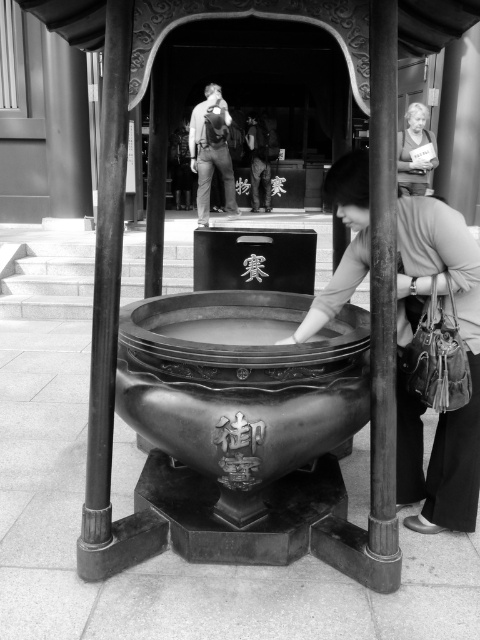
Is smooth wood pole at right bigger than matte gray hair at upper right?

No.

Based on the photo, does smooth wood pole at right lie in front of matte gray hair at upper right?

Yes, it is in front of matte gray hair at upper right.

The image size is (480, 640). Describe the element at coordinates (383, 280) in the screenshot. I see `smooth wood pole at right` at that location.

What are the coordinates of `smooth wood pole at right` in the screenshot? It's located at (383, 280).

Is point (356, 225) in front of point (385, 108)?

No, it is behind (385, 108).

Which is behind, point (441, 273) or point (396, 3)?

Point (441, 273)

Is point (450, 244) more distant than point (394, 268)?

That is True.

You are a GUI agent. You are given a task and a screenshot of the screen. Output one action in this format:
    pyautogui.click(x=<x>, y=<y>)
    Task: Click on the matte bronze bowl at center
    
    Given the screenshot: What is the action you would take?
    pyautogui.click(x=468, y=358)

Does polished bronze pole at left have a greater height compared to matte black backpack at center?

No, polished bronze pole at left is not taller than matte black backpack at center.

Is polished bronze pole at left positioned before matte black backpack at center?

Yes.

The image size is (480, 640). Find the location of `polished bronze pole at left`. polished bronze pole at left is located at coordinates (107, 275).

At what (x,y) coordinates should I click in order to perform the action: click on polished bronze pole at left. Please return your answer as a coordinate pair (x, y). Looking at the image, I should click on (107, 275).